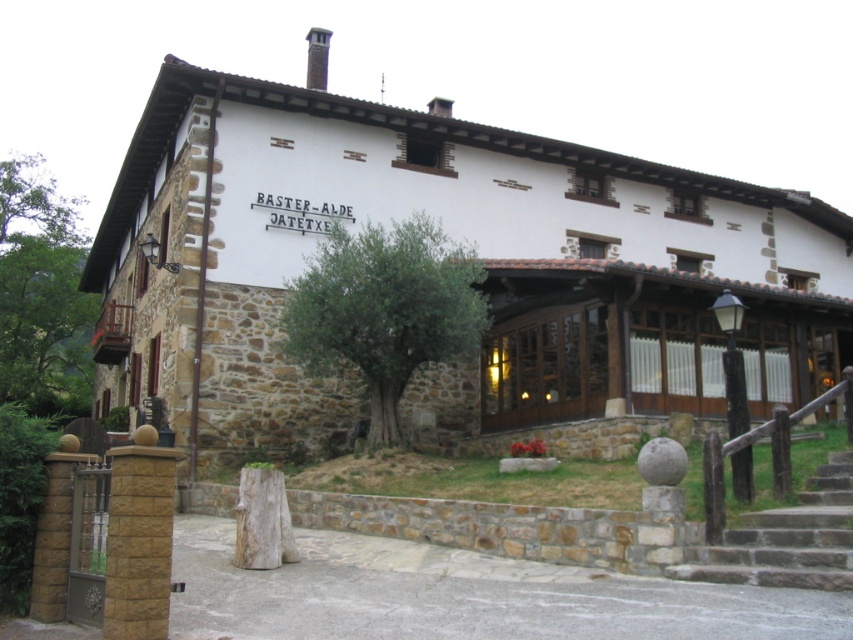
Between white stone building at center and green leafy tree at center, which one has less height?

With less height is green leafy tree at center.

Does white stone building at center appear under green leafy tree at center?

No.

Find the location of a particular element. The image size is (853, 640). white stone building at center is located at coordinates (454, 237).

Which is in front, point (367, 381) or point (790, 525)?

Point (790, 525) is more forward.

Does green leafy tree at center appear under brown stone stairs at lower right?

No, green leafy tree at center is not below brown stone stairs at lower right.

The height and width of the screenshot is (640, 853). What do you see at coordinates (384, 310) in the screenshot?
I see `green leafy tree at center` at bounding box center [384, 310].

Locate an element on the screen. This screenshot has height=640, width=853. green leafy tree at center is located at coordinates (384, 310).

Between point (151, 144) and point (708, 570), which one is positioned in front?

Point (708, 570) is in front.

This screenshot has width=853, height=640. I want to click on white stone building at center, so click(x=454, y=237).